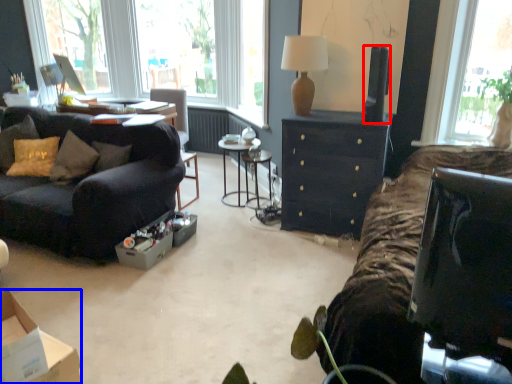
Question: Which object is further to the camera taking this photo, television (highlighted by a red box) or box (highlighted by a blue box)?

Choices:
 (A) television
 (B) box

Answer: (A)